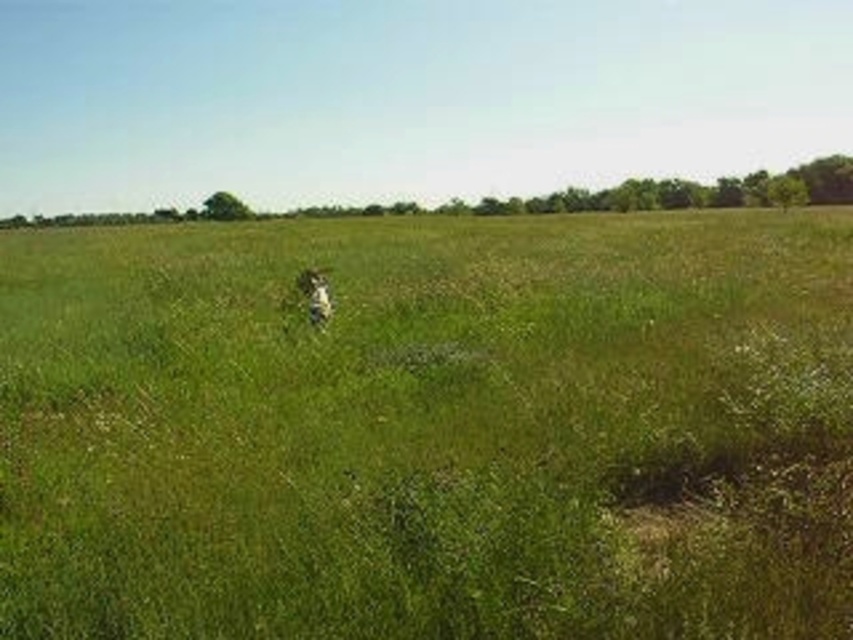
Question: Which object appears farthest from the camera in this image?

Choices:
 (A) green grassy pasture at center
 (B) white fur dog at center

Answer: (B)

Question: Is green grassy pasture at center further to camera compared to white fur dog at center?

Choices:
 (A) yes
 (B) no

Answer: (B)

Question: Which point is closer to the camera?

Choices:
 (A) (267, 614)
 (B) (317, 307)

Answer: (A)

Question: Is green grassy pasture at center behind white fur dog at center?

Choices:
 (A) no
 (B) yes

Answer: (A)

Question: Can you confirm if green grassy pasture at center is smaller than white fur dog at center?

Choices:
 (A) yes
 (B) no

Answer: (B)

Question: Which point appears farthest from the camera in this image?

Choices:
 (A) (315, 314)
 (B) (734, 348)

Answer: (A)